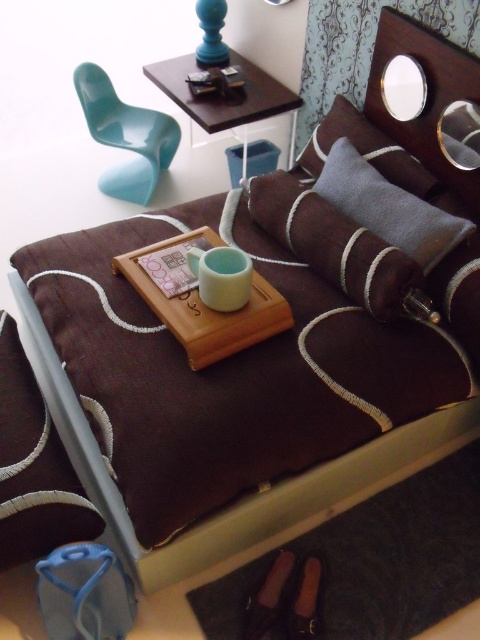
The image size is (480, 640). Describe the element at coordinates (334, 244) in the screenshot. I see `brown textured pillow at center` at that location.

Can you confirm if brown textured pillow at center is positioned to the right of velvet gray pillow at upper right?

Incorrect, brown textured pillow at center is not on the right side of velvet gray pillow at upper right.

Describe the element at coordinates (334, 244) in the screenshot. I see `brown textured pillow at center` at that location.

At what (x,y) coordinates should I click in order to perform the action: click on brown textured pillow at center. Please return your answer as a coordinate pair (x, y). Looking at the image, I should click on (334, 244).

Is dark wood table at upper center positioned before velvet gray pillow at upper right?

No, it is not.

Is dark wood table at upper center wider than velvet gray pillow at upper right?

Correct, the width of dark wood table at upper center exceeds that of velvet gray pillow at upper right.

Consider the image. Measure the distance between point (273, 100) and camera.

They are 7.43 feet apart.

This screenshot has width=480, height=640. Identify the location of dark wood table at upper center. (224, 99).

Who is more distant from viewer, (385, 124) or (115, 124)?

The point (115, 124) is behind.

Does wooden headboard at upper right have a greater width compared to glossy plastic chair at upper left?

In fact, wooden headboard at upper right might be narrower than glossy plastic chair at upper left.

Where is `wooden headboard at upper right`? This screenshot has width=480, height=640. wooden headboard at upper right is located at coordinates [427, 96].